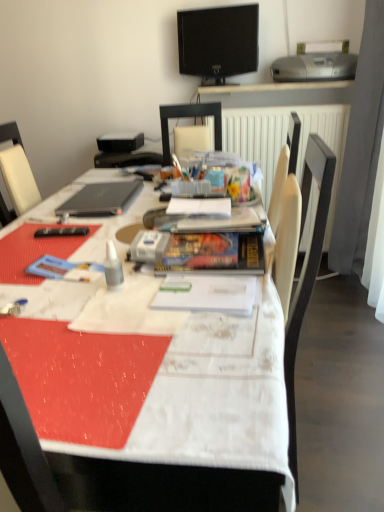
The height and width of the screenshot is (512, 384). In order to click on vacant space that is to the left of clear plastic bottle at center in this screenshot , I will do `click(54, 290)`.